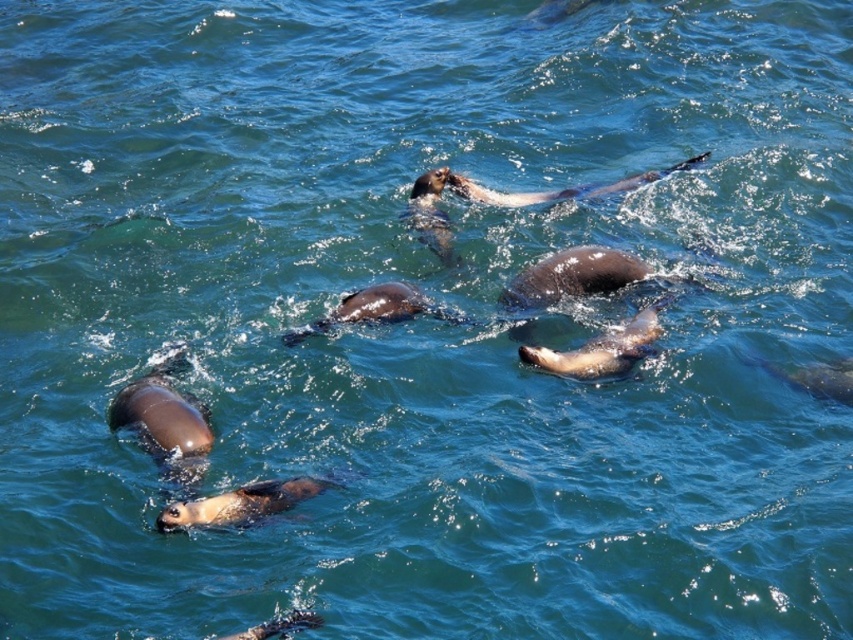
Consider the image. Is brown fur seal at center below brown fur seal at upper center?

Yes, brown fur seal at center is below brown fur seal at upper center.

Is point (631, 348) positioned after point (466, 182)?

No, (631, 348) is in front of (466, 182).

Does point (650, 317) come in front of point (695, 161)?

That is True.

At what (x,y) coordinates should I click in order to perform the action: click on brown fur seal at center. Please return your answer as a coordinate pair (x, y). The width and height of the screenshot is (853, 640). Looking at the image, I should click on (601, 349).

Does brown fur seal at lower center come behind brown fur seal at center?

No.

Locate an element on the screen. This screenshot has width=853, height=640. brown fur seal at lower center is located at coordinates (241, 502).

Does brown fur seal at lower center lie behind brown fur seal at upper center?

No, brown fur seal at lower center is closer to the viewer.

Who is more distant from viewer, (238, 504) or (512, 198)?

The point (512, 198) is more distant.

Who is more distant from viewer, (271, 502) or (630, 179)?

The point (630, 179) is more distant.

At what (x,y) coordinates should I click in order to perform the action: click on brown fur seal at lower center. Please return your answer as a coordinate pair (x, y). The height and width of the screenshot is (640, 853). Looking at the image, I should click on (241, 502).